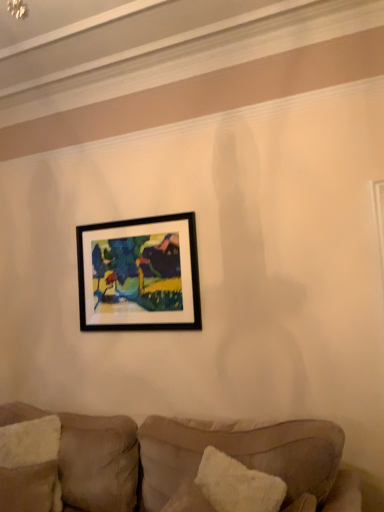
Question: Can you confirm if black matte picture frame at upper center is smaller than white textured pillow at lower left, which is the 2th pillow from right to left?

Choices:
 (A) no
 (B) yes

Answer: (A)

Question: Is black matte picture frame at upper center shorter than white textured pillow at lower left, which is counted as the 2th pillow, starting from the front?

Choices:
 (A) no
 (B) yes

Answer: (A)

Question: Is black matte picture frame at upper center positioned before white textured pillow at lower left, the 1th pillow positioned from the left?

Choices:
 (A) yes
 (B) no

Answer: (B)

Question: From the image's perspective, would you say black matte picture frame at upper center is positioned over white textured pillow at lower left, the 1th pillow positioned from the left?

Choices:
 (A) yes
 (B) no

Answer: (A)

Question: Can we say black matte picture frame at upper center lies outside white textured pillow at lower left, the 1th pillow positioned from the left?

Choices:
 (A) no
 (B) yes

Answer: (B)

Question: Considering the relative sizes of black matte picture frame at upper center and white textured pillow at lower left, the 1th pillow positioned from the left, in the image provided, is black matte picture frame at upper center bigger than white textured pillow at lower left, the 1th pillow positioned from the left,?

Choices:
 (A) yes
 (B) no

Answer: (A)

Question: Is velvet beige couch at lower center shorter than white fluffy pillow at lower right, which is counted as the 2th pillow, starting from the left?

Choices:
 (A) no
 (B) yes

Answer: (A)

Question: From the image's perspective, is velvet beige couch at lower center under white fluffy pillow at lower right, which is counted as the 2th pillow, starting from the left?

Choices:
 (A) no
 (B) yes

Answer: (B)

Question: Is velvet beige couch at lower center oriented away from white fluffy pillow at lower right, which is counted as the 2th pillow, starting from the left?

Choices:
 (A) yes
 (B) no

Answer: (B)

Question: From a real-world perspective, is velvet beige couch at lower center under white fluffy pillow at lower right, which is counted as the 1th pillow, starting from the front?

Choices:
 (A) no
 (B) yes

Answer: (B)

Question: Is velvet beige couch at lower center positioned before white fluffy pillow at lower right, which appears as the 1th pillow when viewed from the right?

Choices:
 (A) yes
 (B) no

Answer: (A)

Question: Can you confirm if velvet beige couch at lower center is taller than white fluffy pillow at lower right, which is counted as the 1th pillow, starting from the front?

Choices:
 (A) yes
 (B) no

Answer: (A)

Question: Is black matte picture frame at upper center further to the viewer compared to white fluffy pillow at lower right, which appears as the 1th pillow when viewed from the right?

Choices:
 (A) no
 (B) yes

Answer: (B)